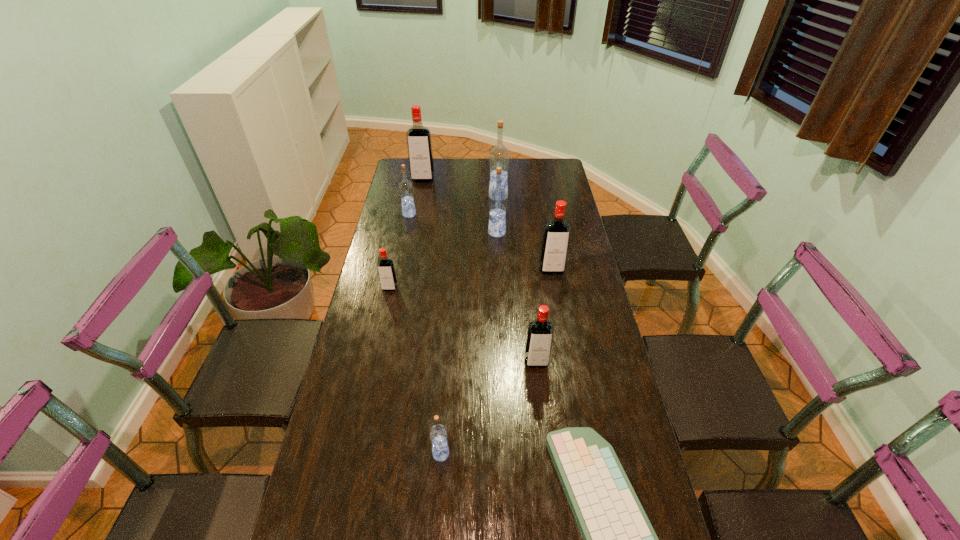
Locate an element on the screen. the second nearest vodka is located at coordinates (540, 332).

I want to click on the seventh farthest object, so click(540, 332).

The image size is (960, 540). I want to click on the second nearest red vodka, so click(x=386, y=271).

Identify the location of the sixth farthest object. The height and width of the screenshot is (540, 960). (386, 271).

Locate an element on the screen. The width and height of the screenshot is (960, 540). the nearest blue vodka is located at coordinates (438, 434).

Identify the location of the fourth object from left to right. (438, 434).

Locate an element on the screen. Image resolution: width=960 pixels, height=540 pixels. free spot located on the front and back of the farthest red vodka is located at coordinates tap(416, 218).

You are a GUI agent. You are given a task and a screenshot of the screen. Output one action in this format:
    pyautogui.click(x=<x>, y=<y>)
    Task: Click on the vacant area situated on the left of the second farthest object
    This screenshot has width=960, height=540.
    Given the screenshot: What is the action you would take?
    click(x=419, y=197)

Identify the location of free point located on the front and back of the third nearest red vodka. (563, 334).

Locate an element on the screen. This screenshot has height=540, width=960. vacant space located 0.370m on the left of the third smallest blue vodka is located at coordinates (399, 233).